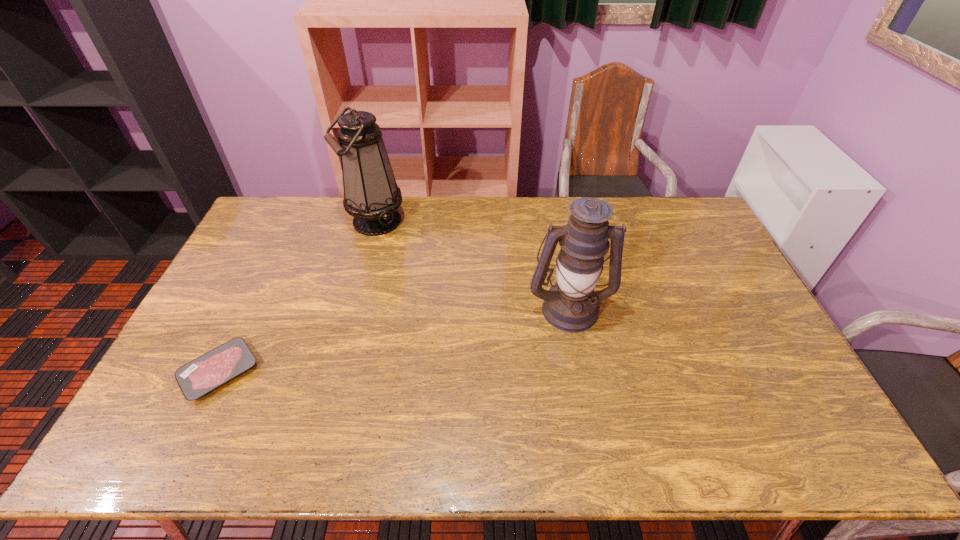
The image size is (960, 540). I want to click on vacant space that's between the left oil lamp and the steak, so click(298, 296).

The width and height of the screenshot is (960, 540). What are the coordinates of `vacant space in between the left oil lamp and the nearer oil lamp` in the screenshot? It's located at (472, 265).

Image resolution: width=960 pixels, height=540 pixels. I want to click on free space between the leftmost object and the second farthest object, so click(x=395, y=340).

At what (x,y) coordinates should I click in order to perform the action: click on free space between the left oil lamp and the right oil lamp. Please return your answer as a coordinate pair (x, y). Looking at the image, I should click on (472, 265).

You are a GUI agent. You are given a task and a screenshot of the screen. Output one action in this format:
    pyautogui.click(x=<x>, y=<y>)
    Task: Click on the vacant space that's between the farthest object and the shortest object
    Image resolution: width=960 pixels, height=540 pixels.
    Given the screenshot: What is the action you would take?
    pyautogui.click(x=298, y=296)

Identify the location of free spot between the farthest object and the shortest object. The height and width of the screenshot is (540, 960). (298, 296).

Find the location of a particular element. vacant area between the rightmost object and the farthest object is located at coordinates (472, 265).

Locate an element on the screen. The image size is (960, 540). object that is the closest to the shortest object is located at coordinates (371, 195).

You are a GUI agent. You are given a task and a screenshot of the screen. Output one action in this format:
    pyautogui.click(x=<x>, y=<y>)
    Task: Click on the second closest object relative to the rightmost object
    The image size is (960, 540).
    Given the screenshot: What is the action you would take?
    point(197,378)

Locate an element on the screen. free space that satisfies the following two spatial constraints: 1. on the front side of the right oil lamp; 2. on the right side of the farther oil lamp is located at coordinates point(352,308).